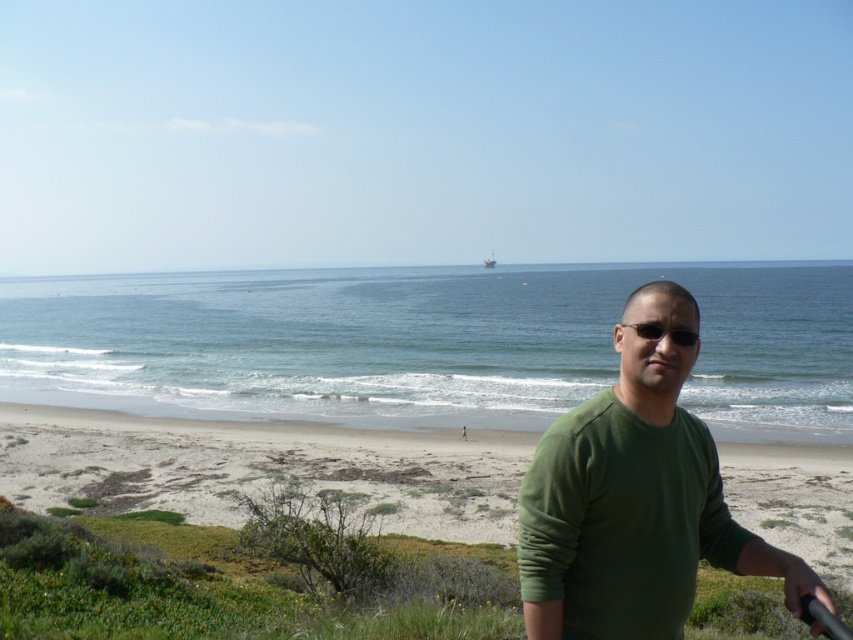
Question: Which object is positioned closest to the smooth sand beach at center?

Choices:
 (A) green matte sweater at center
 (B) black plastic sunglasses at center

Answer: (B)

Question: From the image, what is the correct spatial relationship of smooth sand beach at center in relation to black plastic sunglasses at center?

Choices:
 (A) left
 (B) right

Answer: (A)

Question: Is green matte sweater at center in front of black plastic sunglasses at center?

Choices:
 (A) no
 (B) yes

Answer: (B)

Question: Which of these objects is positioned farthest from the black plastic sunglasses at center?

Choices:
 (A) smooth sand beach at center
 (B) green matte sweater at center

Answer: (A)

Question: Which is nearer to the smooth sand beach at center?

Choices:
 (A) green matte sweater at center
 (B) black plastic sunglasses at center

Answer: (B)

Question: Can you confirm if smooth sand beach at center is positioned below black plastic sunglasses at center?

Choices:
 (A) yes
 (B) no

Answer: (A)